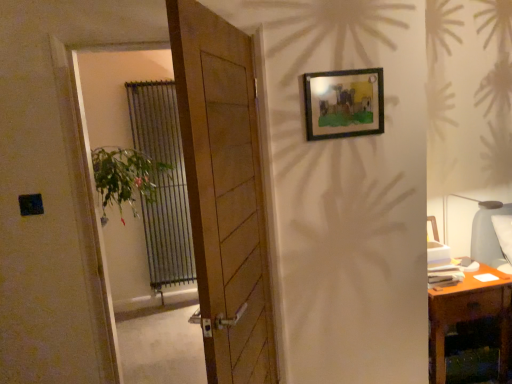
At what (x,y) coordinates should I click in order to perform the action: click on metallic silver radiator at left. Please return your answer as a coordinate pair (x, y). The height and width of the screenshot is (384, 512). Looking at the image, I should click on (163, 184).

Image resolution: width=512 pixels, height=384 pixels. What do you see at coordinates (469, 315) in the screenshot?
I see `wooden desk at right` at bounding box center [469, 315].

Find the location of a particular element. The height and width of the screenshot is (384, 512). wooden desk at right is located at coordinates (469, 315).

Image resolution: width=512 pixels, height=384 pixels. What do you see at coordinates (463, 218) in the screenshot?
I see `matte gray lampshade at right` at bounding box center [463, 218].

Where is `matte gray lampshade at right`? The width and height of the screenshot is (512, 384). matte gray lampshade at right is located at coordinates (463, 218).

Locate an element on the screen. The image size is (512, 384). wooden door at center is located at coordinates (224, 193).

What is the approximate width of wooden door at center?

5.95 inches.

This screenshot has height=384, width=512. In order to click on metallic silver radiator at left in this screenshot , I will do 163,184.

Locate an element on the screen. Image resolution: width=512 pixels, height=384 pixels. picture frame in front of the wooden desk at right is located at coordinates (343, 103).

Consider the image. Can you confirm if wooden desk at right is thinner than wooden frame at upper right?

Incorrect, the width of wooden desk at right is not less than that of wooden frame at upper right.

From their relative heights in the image, would you say wooden desk at right is taller or shorter than wooden frame at upper right?

Clearly, wooden desk at right is taller compared to wooden frame at upper right.

How many degrees apart are the facing directions of wooden desk at right and wooden frame at upper right?

0.184 degrees separate the facing orientations of wooden desk at right and wooden frame at upper right.

At what (x,y) coordinates should I click in order to perform the action: click on table lamp above the wooden desk at right (from a real-world perspective). Please return your answer as a coordinate pair (x, y). Looking at the image, I should click on (x=463, y=218).

Can you confirm if matte gray lampshade at right is bigger than wooden desk at right?

Actually, matte gray lampshade at right might be smaller than wooden desk at right.

Between matte gray lampshade at right and wooden desk at right, which one is positioned behind?

wooden desk at right.

Is wooden desk at right at the back of matte gray lampshade at right?

matte gray lampshade at right is not turned away from wooden desk at right.

Considering the relative sizes of wooden door at center and wooden frame at upper right in the image provided, is wooden door at center thinner than wooden frame at upper right?

Incorrect, the width of wooden door at center is not less than that of wooden frame at upper right.

Is point (242, 376) behind point (369, 124)?

No, it is in front of (369, 124).

In the image, there is a wooden frame at upper right. In order to click on door below it (from the image's perspective) in this screenshot , I will do `click(224, 193)`.

From a real-world perspective, between wooden frame at upper right and wooden door at center, who is vertically higher?

In real-world perspective, wooden frame at upper right is above.

Is the surface of wooden frame at upper right in direct contact with wooden door at center?

No, wooden frame at upper right is not beside wooden door at center.

Which is behind, point (331, 106) or point (251, 236)?

The point (331, 106) is more distant.

Is wooden frame at upper right not within wooden door at center?

That's correct, wooden frame at upper right is outside of wooden door at center.

Is metallic silver radiator at left positioned with its back to green leafy plant at left?

metallic silver radiator at left does not have its back to green leafy plant at left.

From the image's perspective, is metallic silver radiator at left under green leafy plant at left?

Correct, metallic silver radiator at left appears lower than green leafy plant at left in the image.

Does matte gray lampshade at right turn towards metallic silver radiator at left?

No, matte gray lampshade at right is not facing towards metallic silver radiator at left.

The image size is (512, 384). I want to click on curtain on the left of matte gray lampshade at right, so click(163, 184).

Considering the sizes of objects matte gray lampshade at right and metallic silver radiator at left in the image provided, who is smaller, matte gray lampshade at right or metallic silver radiator at left?

matte gray lampshade at right is smaller.

Are matte gray lampshade at right and metallic silver radiator at left far apart?

matte gray lampshade at right is far away from metallic silver radiator at left.

Do you think wooden frame at upper right is within green leafy plant at left, or outside of it?

wooden frame at upper right is spatially situated outside green leafy plant at left.

From a real-world perspective, between wooden frame at upper right and green leafy plant at left, who is vertically higher?

wooden frame at upper right is physically above.

Which object is further away from the camera, wooden frame at upper right or green leafy plant at left?

wooden frame at upper right is more distant.

From the image's perspective, which one is positioned higher, wooden frame at upper right or green leafy plant at left?

wooden frame at upper right is shown above in the image.

Identify the location of table located on the right of wooden frame at upper right. (x=469, y=315).

This screenshot has height=384, width=512. I want to click on table that appears below the matte gray lampshade at right (from the image's perspective), so click(469, 315).

Looking at the image, which one is located further to wooden frame at upper right, green leafy plant at left or matte gray lampshade at right?

matte gray lampshade at right is positioned further to the anchor wooden frame at upper right.

Estimate the real-world distances between objects in this image. Which object is closer to metallic silver radiator at left, matte gray lampshade at right or wooden desk at right?

The object closer to metallic silver radiator at left is matte gray lampshade at right.

Consider the image. Considering their positions, is wooden desk at right positioned closer to green leafy plant at left than wooden door at center?

The object closer to green leafy plant at left is wooden door at center.

Based on their spatial positions, is wooden desk at right or green leafy plant at left closer to metallic silver radiator at left?

green leafy plant at left lies closer to metallic silver radiator at left than the other object.

From the picture: Considering their positions, is wooden desk at right positioned further to metallic silver radiator at left than matte gray lampshade at right?

wooden desk at right is positioned further to the anchor metallic silver radiator at left.

Considering their positions, is wooden frame at upper right positioned closer to metallic silver radiator at left than green leafy plant at left?

green leafy plant at left.

Considering their positions, is wooden door at center positioned closer to green leafy plant at left than wooden desk at right?

wooden door at center.

Estimate the real-world distances between objects in this image. Which object is further from wooden frame at upper right, metallic silver radiator at left or matte gray lampshade at right?

metallic silver radiator at left is further to wooden frame at upper right.

Locate an element on the screen. picture frame between metallic silver radiator at left and matte gray lampshade at right is located at coordinates (343, 103).

Where is `door between green leafy plant at left and wooden frame at upper right from left to right`? door between green leafy plant at left and wooden frame at upper right from left to right is located at coordinates (224, 193).

Find the location of a particular element. This screenshot has height=384, width=512. table located between green leafy plant at left and matte gray lampshade at right in the left-right direction is located at coordinates (469, 315).

Image resolution: width=512 pixels, height=384 pixels. I want to click on picture frame between green leafy plant at left and matte gray lampshade at right from left to right, so click(343, 103).